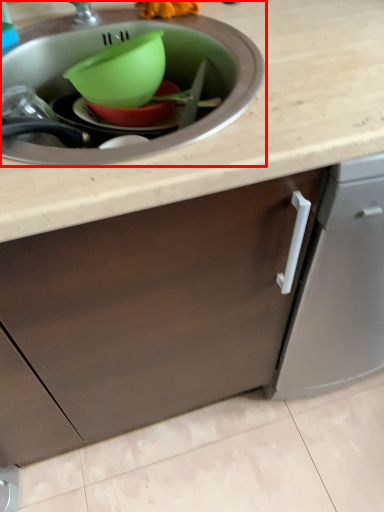
Question: In this image, where is sink (annotated by the red box) located relative to basin?

Choices:
 (A) right
 (B) left

Answer: (B)